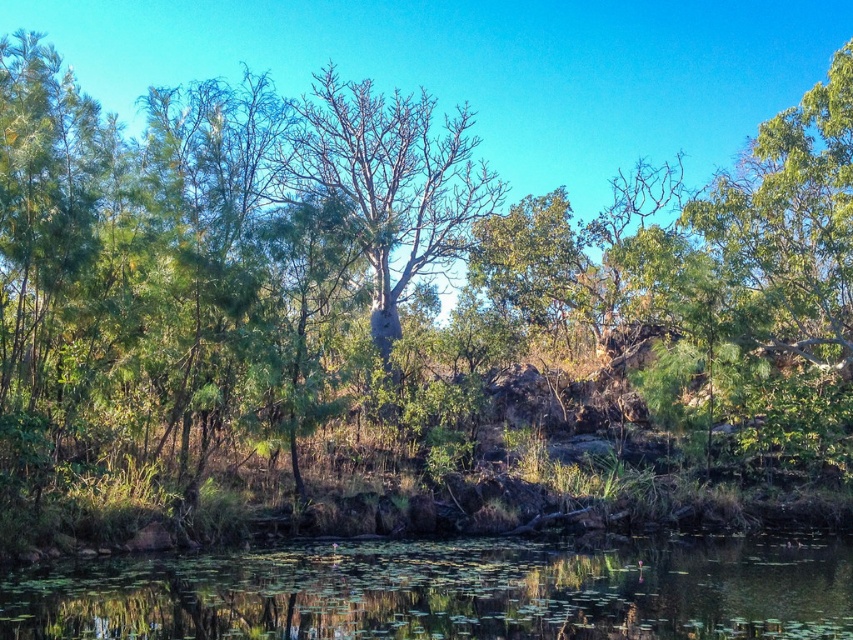
Looking at this image, you are standing at the edge of the water and want to take a photo of the bare wood tree at center without the green leafy water at lower center blocking the view. How should you adjust your position?

Move backward away from the green leafy water at lower center so that the bare wood tree at center becomes visible behind it, since the green leafy water at lower center is in front of the bare wood tree at center.